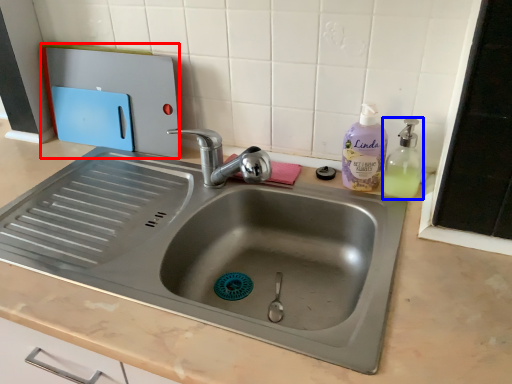
Question: Among these objects, which one is nearest to the camera, appliance (highlighted by a red box) or soap dispenser (highlighted by a blue box)?

Choices:
 (A) appliance
 (B) soap dispenser

Answer: (B)